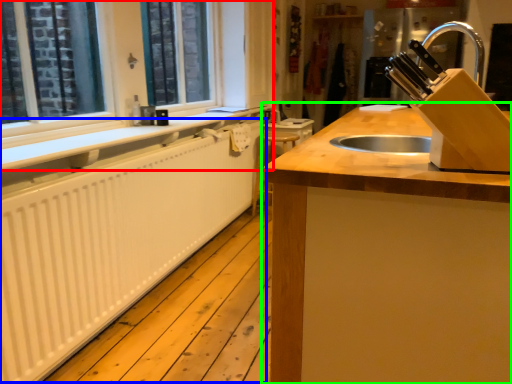
Question: Considering the real-world distances, which object is farthest from window frame (highlighted by a red box)? radiator (highlighted by a blue box) or countertop (highlighted by a green box)?

Choices:
 (A) radiator
 (B) countertop

Answer: (B)